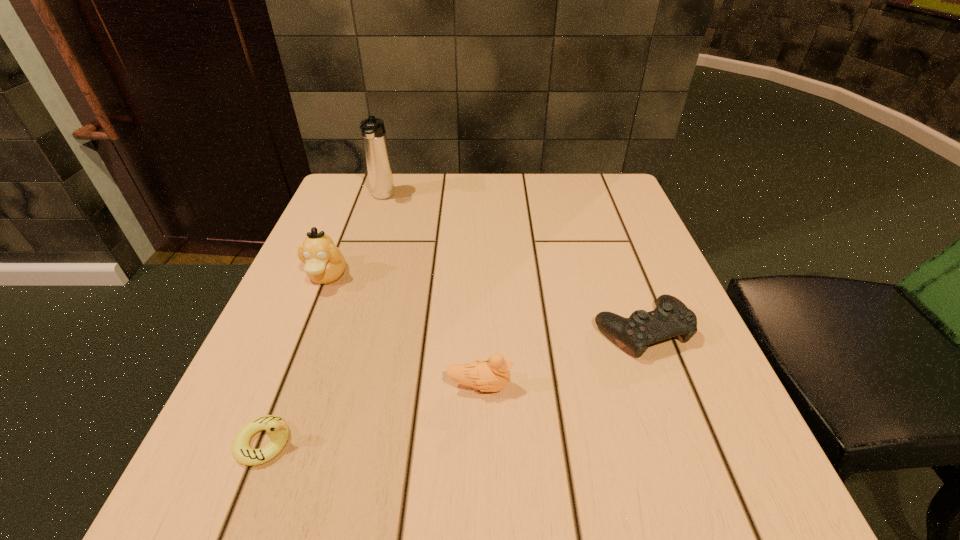
At what (x,y) coordinates should I click in order to perform the action: click on vacant area situated on the handle side of the thermos bottle. Please return your answer as a coordinate pair (x, y). This screenshot has height=540, width=960. Looking at the image, I should click on (356, 280).

Where is `vacant space located on the face of the farthest duckling`? vacant space located on the face of the farthest duckling is located at coordinates (307, 326).

I want to click on free space located on the face of the third shortest object, so click(x=621, y=386).

At what (x,y) coordinates should I click in order to perform the action: click on free space located 0.230m on the left of the fourth tallest object. Please return your answer as a coordinate pair (x, y). This screenshot has height=540, width=960. Looking at the image, I should click on (464, 330).

At what (x,y) coordinates should I click in order to perform the action: click on vacant area located 0.320m on the face of the nearest duckling. Please return your answer as a coordinate pair (x, y). Looking at the image, I should click on (523, 443).

The height and width of the screenshot is (540, 960). In order to click on object that is positioned at the far edge in this screenshot , I will do `click(375, 144)`.

The width and height of the screenshot is (960, 540). Find the location of `object present at the near edge`. object present at the near edge is located at coordinates [277, 429].

Locate an element on the screen. Image resolution: width=960 pixels, height=540 pixels. thermos bottle at the left edge is located at coordinates (375, 144).

Identify the location of object located at the right edge. (671, 317).

In order to click on object that is at the far left corner in this screenshot , I will do `click(375, 144)`.